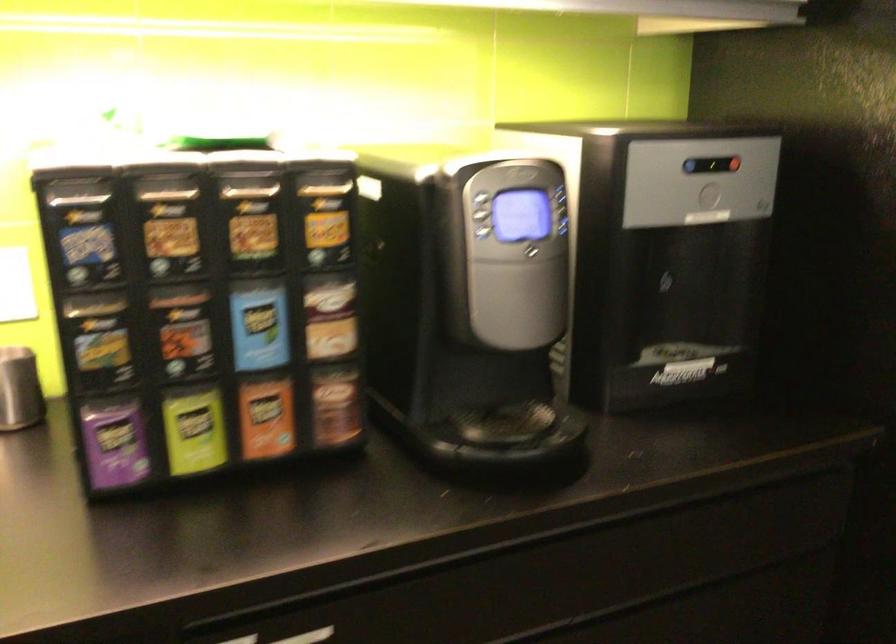
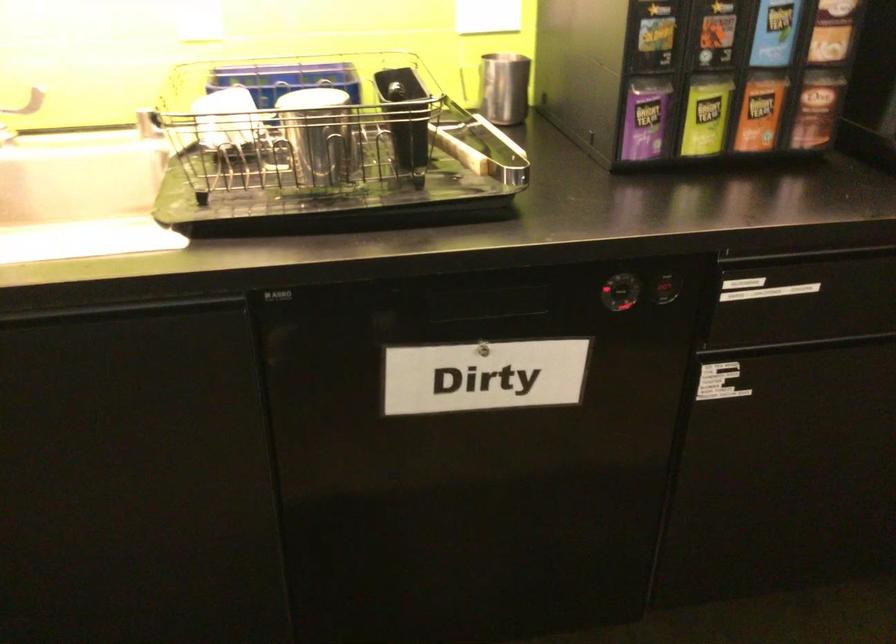
In a continuous first-person perspective shot, in which direction is the camera moving?

The movement direction of the cameraman is left, backward.